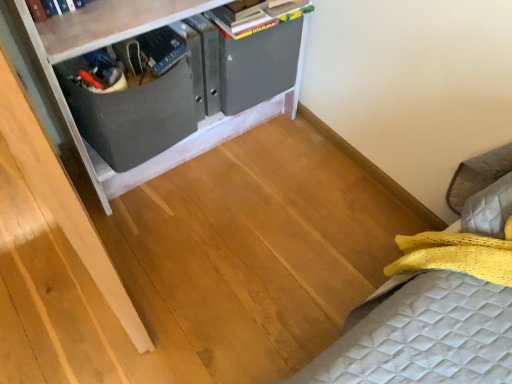
Question: Considering the relative positions of hardcover book at upper center and matte black drawer at center in the image provided, is hardcover book at upper center to the left or to the right of matte black drawer at center?

Choices:
 (A) right
 (B) left

Answer: (A)

Question: From their relative heights in the image, would you say hardcover book at upper center is taller or shorter than matte black drawer at center?

Choices:
 (A) short
 (B) tall

Answer: (A)

Question: Estimate the real-world distances between objects in this image. Which object is closer to the matte black drawer at center?

Choices:
 (A) matte gray cabinet at upper left
 (B) hardcover book at upper center

Answer: (A)

Question: Which is nearer to the hardcover book at upper center?

Choices:
 (A) matte gray cabinet at upper left
 (B) matte black drawer at center

Answer: (A)